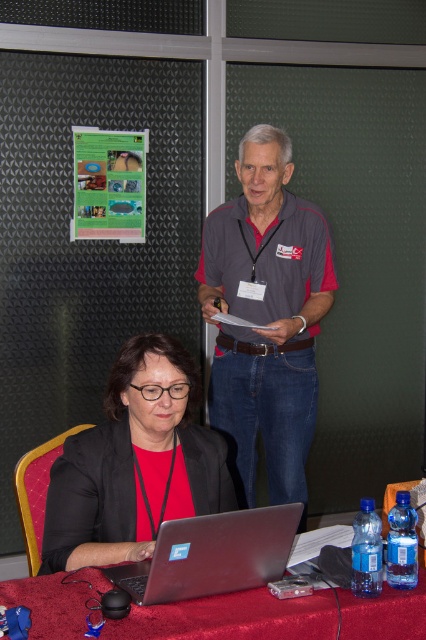
Is gray/denim shirt at center to the left of matte black jacket at lower left from the viewer's perspective?

Incorrect, gray/denim shirt at center is not on the left side of matte black jacket at lower left.

Can you confirm if gray/denim shirt at center is shorter than matte black jacket at lower left?

In fact, gray/denim shirt at center may be taller than matte black jacket at lower left.

At what (x,y) coordinates should I click in order to perform the action: click on gray/denim shirt at center. Please return your answer as a coordinate pair (x, y). Looking at the image, I should click on (267, 314).

Does gray/denim shirt at center have a greater width compared to silver metallic laptop at lower center?

Yes, gray/denim shirt at center is wider than silver metallic laptop at lower center.

From the picture: Who is higher up, gray/denim shirt at center or silver metallic laptop at lower center?

gray/denim shirt at center is above.

Find the location of a particular element. The width and height of the screenshot is (426, 640). gray/denim shirt at center is located at coordinates (267, 314).

Does red velvet tablecloth at lower center have a larger size compared to matte plastic bulletin board at upper left?

Yes.

Who is more distant from viewer, (247,637) or (95,148)?

The point (95,148) is more distant.

Does point (310, 632) lie in front of point (89, 129)?

Yes, point (310, 632) is in front of point (89, 129).

What are the coordinates of `red velvet tablecloth at lower center` in the screenshot? It's located at (230, 618).